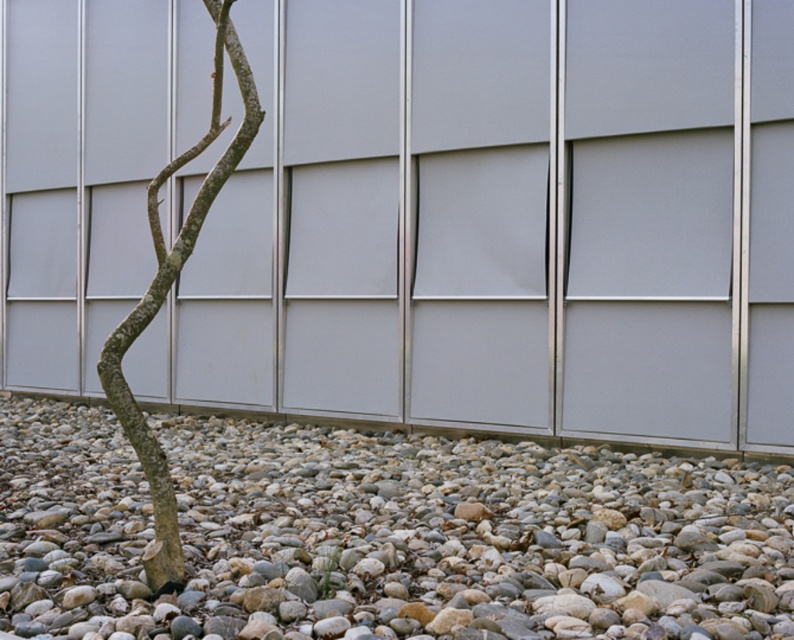
Based on the scene description, where exactly are the smooth pebbles at lower center located in terms of coordinates?

The smooth pebbles at lower center are located at coordinates (382, 532).

You are a landscape architect designing a garden. You need to place a small statue that requires a stable, flat surface. Which object between the smooth pebbles at lower center and the brown rough bark tree at lower left would be more suitable for placing the statue?

The smooth pebbles at lower center would be more suitable for placing the statue since they provide a stable and flat surface compared to the brown rough bark tree at lower left, which is taller and likely uneven.